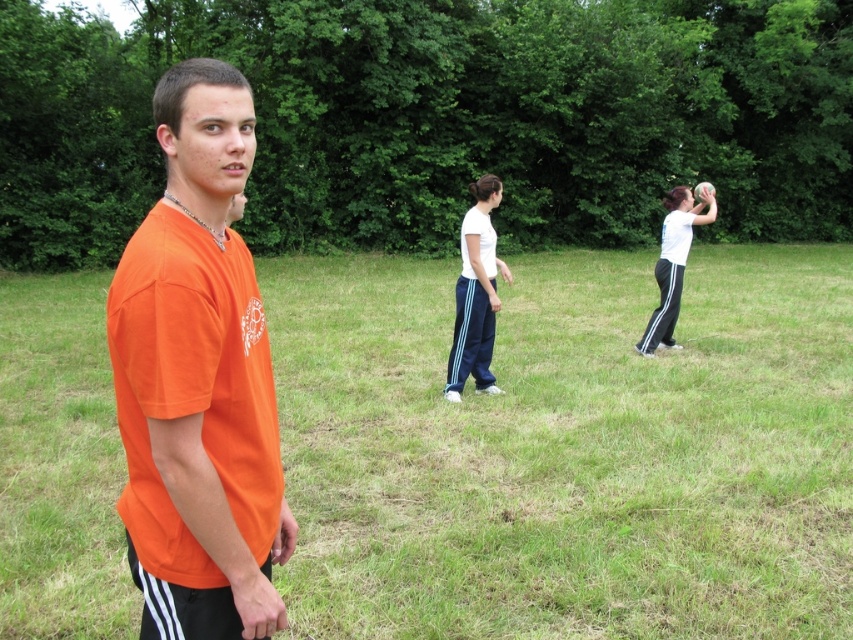
Question: Is orange t-shirt at left behind white matte shirt at center?

Choices:
 (A) no
 (B) yes

Answer: (A)

Question: Among these objects, which one is farthest from the camera?

Choices:
 (A) orange t-shirt at left
 (B) white matte shirt at center

Answer: (B)

Question: Where is orange t-shirt at left located in relation to white smooth pants at center in the image?

Choices:
 (A) above
 (B) below

Answer: (B)

Question: Does green grass at center lie behind orange t-shirt at left?

Choices:
 (A) no
 (B) yes

Answer: (B)

Question: Which object is positioned closest to the white matte shirt at center?

Choices:
 (A) white smooth pants at center
 (B) green grass at center

Answer: (A)

Question: Which of the following is the farthest from the observer?

Choices:
 (A) tap(683, 189)
 (B) tap(267, 465)
 (C) tap(67, 300)

Answer: (C)